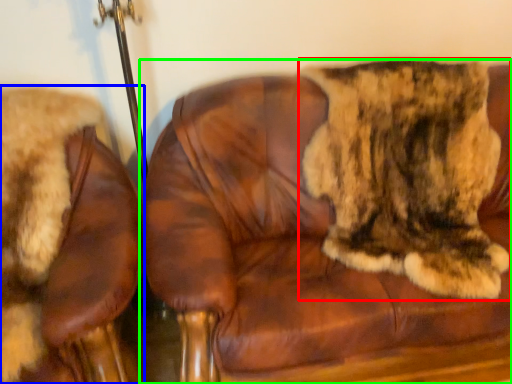
Question: Which object is positioned closest to cat (highlighted by a red box)? Select from chair (highlighted by a blue box) and chair (highlighted by a green box).

Choices:
 (A) chair
 (B) chair

Answer: (B)